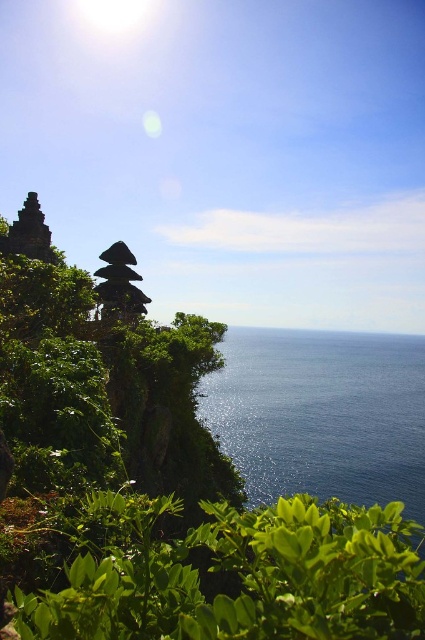
Can you confirm if blue glossy water at lower center is positioned to the left of dark brown stone structure at center?

No, blue glossy water at lower center is not to the left of dark brown stone structure at center.

Can you confirm if blue glossy water at lower center is positioned to the right of dark brown stone structure at center?

Indeed, blue glossy water at lower center is positioned on the right side of dark brown stone structure at center.

Who is more forward, [323,490] or [133,296]?

Point [133,296] is more forward.

Where is `blue glossy water at lower center`? This screenshot has height=640, width=425. blue glossy water at lower center is located at coordinates (322, 413).